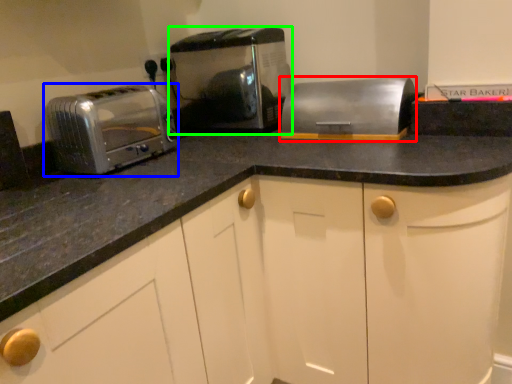
Question: Which is nearer to the appliance (highlighted by a red box)? toaster (highlighted by a blue box) or toaster (highlighted by a green box).

Choices:
 (A) toaster
 (B) toaster

Answer: (B)